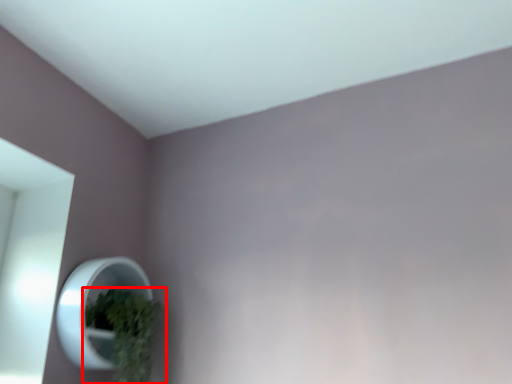
Question: From the image's perspective, where is houseplant (annotated by the red box) located relative to mirror?

Choices:
 (A) below
 (B) above

Answer: (A)